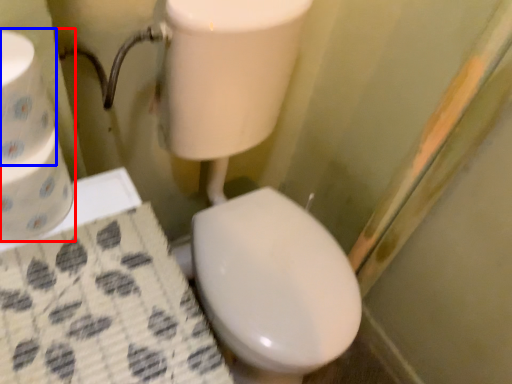
Question: Which point is further to the camera, toilet paper (highlighted by a red box) or toilet paper (highlighted by a blue box)?

Choices:
 (A) toilet paper
 (B) toilet paper

Answer: (A)